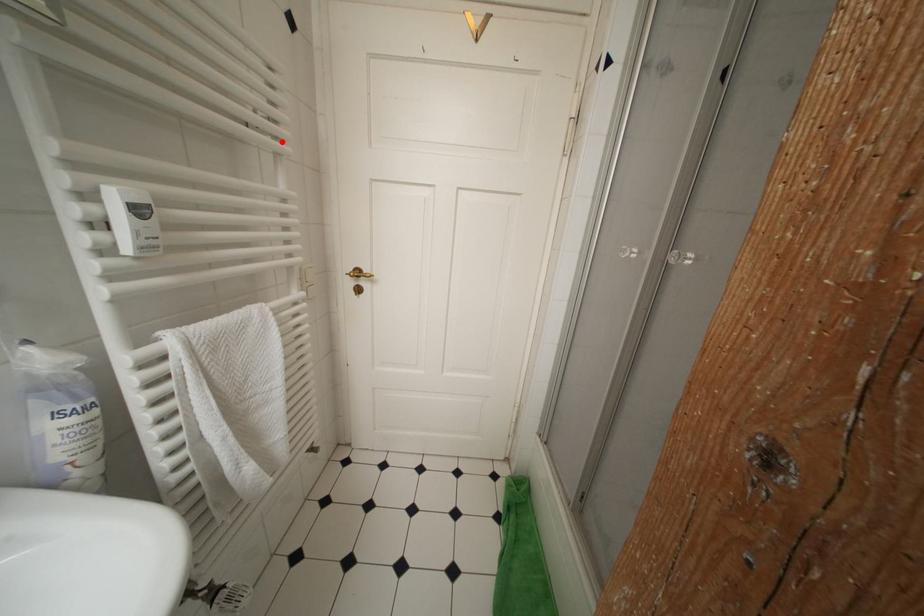
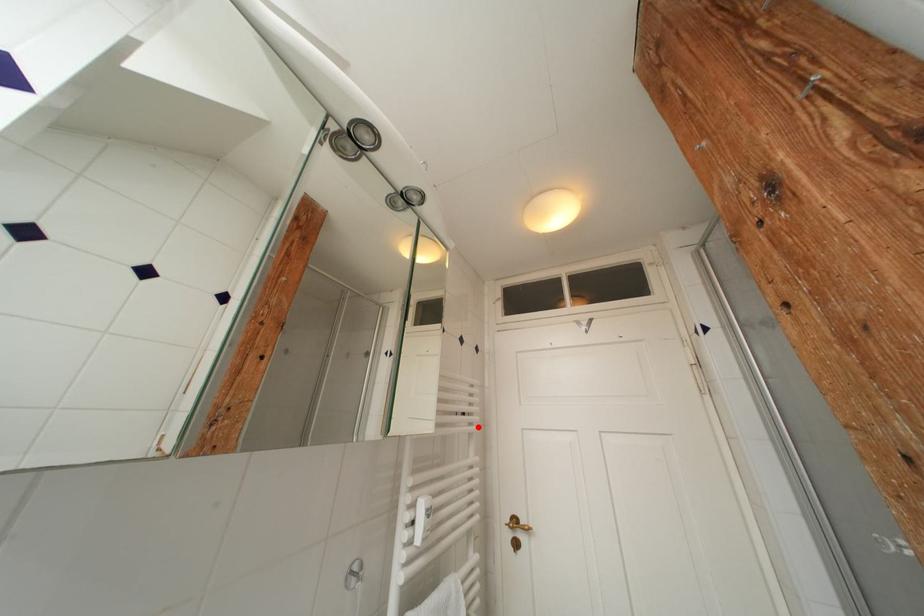
I am providing you with two images of the same scene from different viewpoints. A red point is marked on the first image and another point is marked on the second image. Does the point marked in image1 correspond to the same location as the one in image2?

Yes